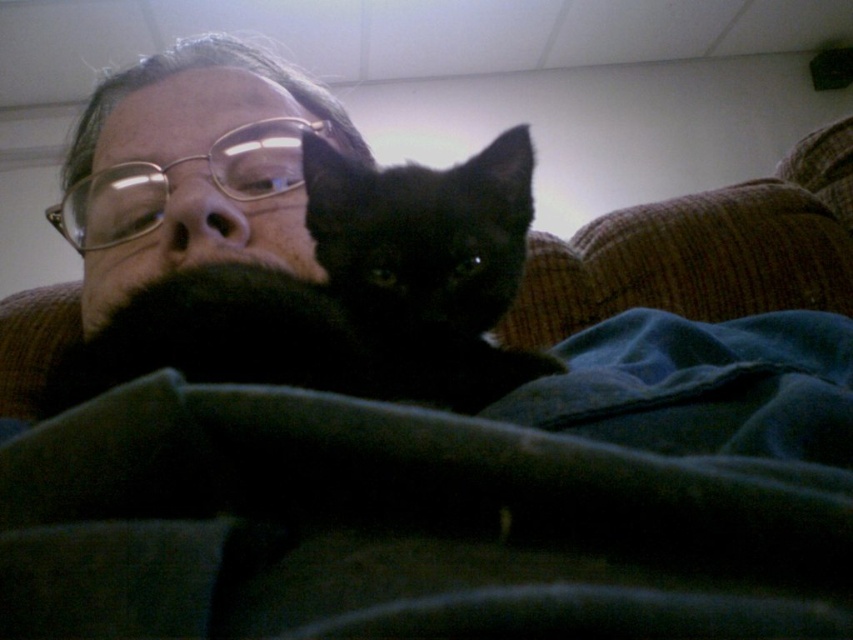
Question: Does black fur cat at center have a larger size compared to brown corduroy couch at upper right?

Choices:
 (A) no
 (B) yes

Answer: (A)

Question: Can you confirm if matte black beard at center is wider than brown corduroy couch at upper right?

Choices:
 (A) yes
 (B) no

Answer: (B)

Question: Which object is closer to the camera taking this photo?

Choices:
 (A) brown corduroy couch at upper right
 (B) black fur cat at center

Answer: (B)

Question: Which point is farther to the camera?

Choices:
 (A) (746, 268)
 (B) (264, 243)
 (C) (358, 225)

Answer: (A)

Question: Can you confirm if matte black beard at center is positioned above brown corduroy couch at upper right?

Choices:
 (A) no
 (B) yes

Answer: (B)

Question: Which point is closer to the camera?

Choices:
 (A) brown corduroy couch at upper right
 (B) matte black beard at center
 (C) black fur cat at center

Answer: (C)